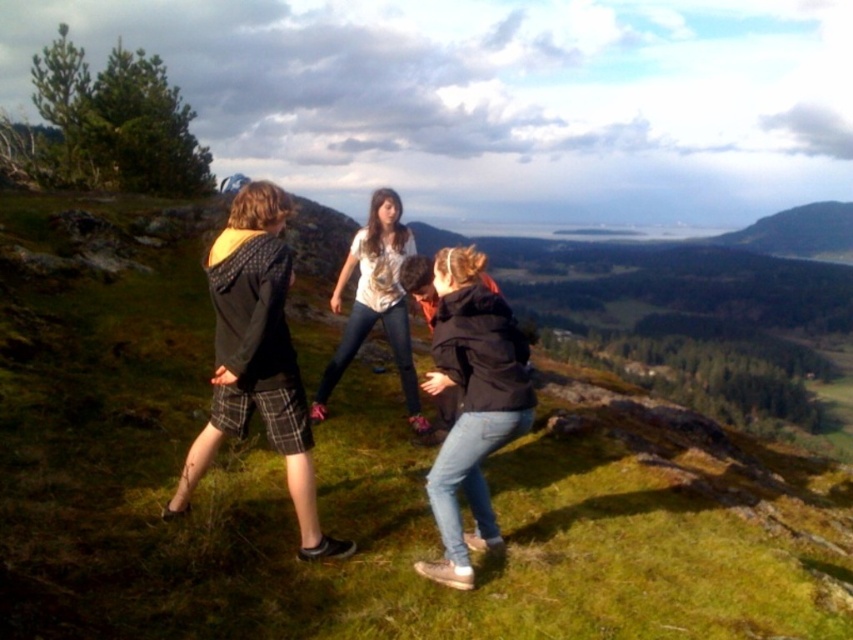
Question: Does denim jeans at center have a greater width compared to white textured blouse at center?

Choices:
 (A) yes
 (B) no

Answer: (B)

Question: Which object is the farthest from the green grassy at center?

Choices:
 (A) white textured blouse at center
 (B) plaid shorts at left

Answer: (A)

Question: Estimate the real-world distances between objects in this image. Which object is closer to the white textured blouse at center?

Choices:
 (A) denim jeans at center
 (B) green grassy at center

Answer: (A)

Question: Is denim jeans at center bigger than white textured blouse at center?

Choices:
 (A) yes
 (B) no

Answer: (B)

Question: Can you confirm if denim jeans at center is smaller than white textured blouse at center?

Choices:
 (A) yes
 (B) no

Answer: (A)

Question: Which point is closer to the camera?

Choices:
 (A) denim jeans at center
 (B) green grassy at center
 (C) white textured blouse at center

Answer: (B)